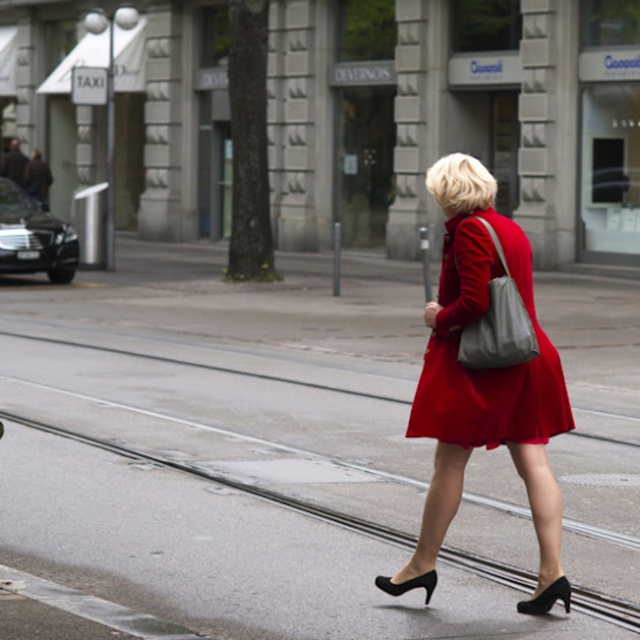
Question: Among these points, which one is farthest from the camera?

Choices:
 (A) (422, 314)
 (B) (397, 582)
 (C) (522, 609)
 (D) (481, 401)

Answer: (A)

Question: Which object is positioned closest to the matte red coat at center?

Choices:
 (A) black leather high-heeled shoe at lower center
 (B) black leather heel at lower center
 (C) satin red dress at center

Answer: (C)

Question: Which object appears farthest from the camera in this image?

Choices:
 (A) black leather heel at lower center
 (B) black leather high-heeled shoe at lower center
 (C) matte red coat at center

Answer: (B)

Question: Can you confirm if satin red dress at center is positioned below black leather heel at lower center?

Choices:
 (A) no
 (B) yes

Answer: (A)

Question: Is satin red dress at center to the left of black leather heel at lower center from the viewer's perspective?

Choices:
 (A) no
 (B) yes

Answer: (B)

Question: From the image, what is the correct spatial relationship of matte red coat at center in relation to black leather high-heeled shoe at lower center?

Choices:
 (A) right
 (B) left

Answer: (A)